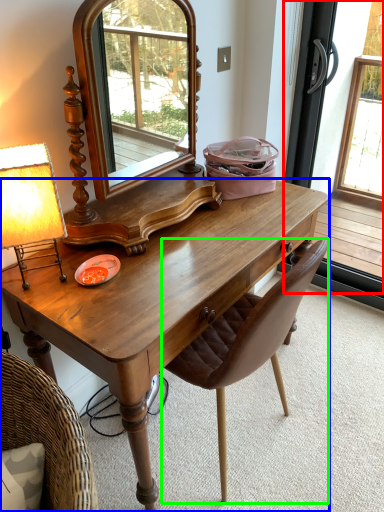
Question: Which is nearer to the screen door (highlighted by a red box)? desk (highlighted by a blue box) or chair (highlighted by a green box).

Choices:
 (A) desk
 (B) chair

Answer: (A)